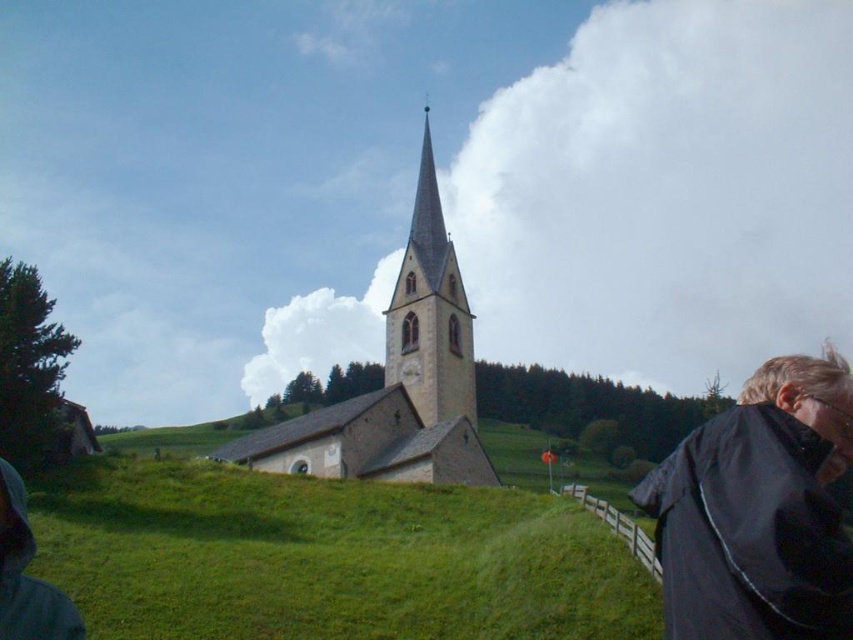
Question: Observing the image, what is the correct spatial positioning of green grassy hillside at center in reference to smooth stone tower at center?

Choices:
 (A) above
 (B) below

Answer: (B)

Question: Considering the real-world distances, which object is closest to the stone church steeple at center?

Choices:
 (A) black matte jacket at lower right
 (B) green grassy hillside at center

Answer: (B)

Question: Does green grassy hillside at center lie in front of black matte jacket at lower right?

Choices:
 (A) yes
 (B) no

Answer: (B)

Question: Which is nearer to the black matte jacket at lower right?

Choices:
 (A) green grassy hillside at center
 (B) smooth stone tower at center

Answer: (A)

Question: Based on their relative distances, which object is farther from the green grassy hillside at center?

Choices:
 (A) smooth stone tower at center
 (B) black matte jacket at lower right
 (C) stone church steeple at center

Answer: (A)

Question: Is black matte jacket at lower right in front of stone church steeple at center?

Choices:
 (A) no
 (B) yes

Answer: (B)